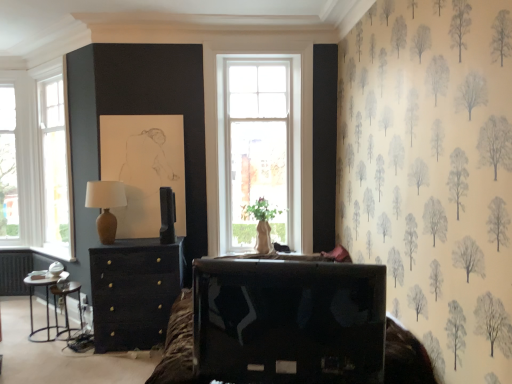
Question: Is the depth of metallic black side table at lower left greater than that of matte black chest of drawers at center?

Choices:
 (A) yes
 (B) no

Answer: (A)

Question: Is metallic black side table at lower left not near matte black chest of drawers at center?

Choices:
 (A) no
 (B) yes

Answer: (B)

Question: Can you confirm if metallic black side table at lower left is positioned to the left of matte black chest of drawers at center?

Choices:
 (A) no
 (B) yes

Answer: (B)

Question: Is metallic black side table at lower left to the right of matte black chest of drawers at center from the viewer's perspective?

Choices:
 (A) yes
 (B) no

Answer: (B)

Question: From a real-world perspective, is metallic black side table at lower left located beneath matte black chest of drawers at center?

Choices:
 (A) yes
 (B) no

Answer: (A)

Question: Considering the relative sizes of metallic black side table at lower left and matte black chest of drawers at center in the image provided, is metallic black side table at lower left taller than matte black chest of drawers at center?

Choices:
 (A) no
 (B) yes

Answer: (A)

Question: Is matte black chest of drawers at center shorter than matte brown table lamp at left?

Choices:
 (A) no
 (B) yes

Answer: (A)

Question: Is matte black chest of drawers at center not inside matte brown table lamp at left?

Choices:
 (A) no
 (B) yes

Answer: (B)

Question: From the image's perspective, is matte black chest of drawers at center located above matte brown table lamp at left?

Choices:
 (A) no
 (B) yes

Answer: (A)

Question: Is matte black chest of drawers at center oriented away from matte brown table lamp at left?

Choices:
 (A) yes
 (B) no

Answer: (B)

Question: Is matte black chest of drawers at center positioned before matte brown table lamp at left?

Choices:
 (A) yes
 (B) no

Answer: (B)

Question: Considering the relative positions of matte black chest of drawers at center and matte brown table lamp at left in the image provided, is matte black chest of drawers at center to the left of matte brown table lamp at left from the viewer's perspective?

Choices:
 (A) no
 (B) yes

Answer: (A)

Question: From the image's perspective, is metallic silver side table at lower left above matte brown table lamp at left?

Choices:
 (A) no
 (B) yes

Answer: (A)